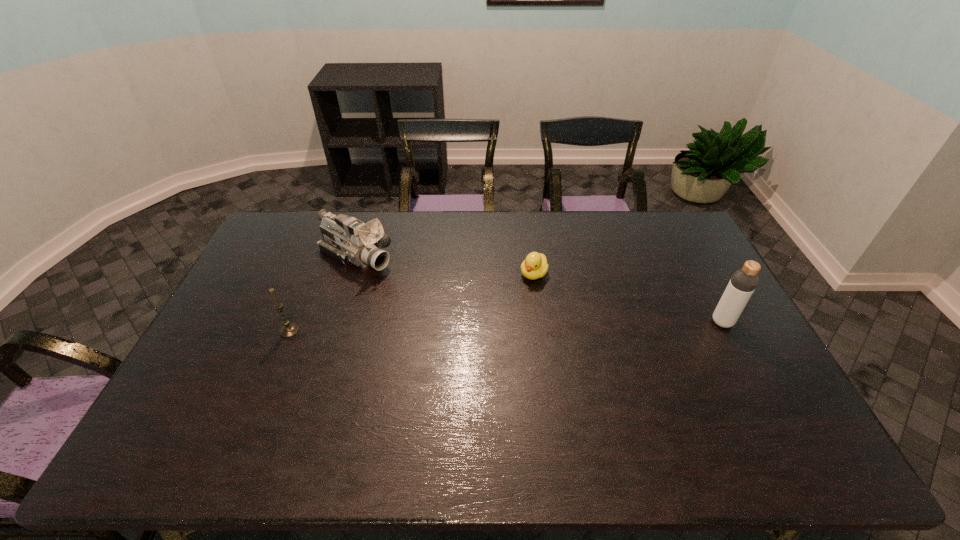
Where is `vacant space at the far right corner of the desktop`? Image resolution: width=960 pixels, height=540 pixels. vacant space at the far right corner of the desktop is located at coordinates (659, 216).

Where is `free space at the near right corner`? free space at the near right corner is located at coordinates (767, 419).

This screenshot has width=960, height=540. Identify the location of vacant space in between the camcorder and the candle. (323, 294).

Where is `vacant area that lies between the candle and the camcorder`? vacant area that lies between the candle and the camcorder is located at coordinates (323, 294).

The image size is (960, 540). I want to click on free space between the duckling and the bottle, so click(x=628, y=298).

Find the location of `vacant area that lies between the candle and the camcorder`. vacant area that lies between the candle and the camcorder is located at coordinates (323, 294).

At what (x,y) coordinates should I click in order to perform the action: click on empty space between the camcorder and the third object from left to right. Please return your answer as a coordinate pair (x, y). The image size is (960, 540). Looking at the image, I should click on (444, 266).

Where is `vacant space in between the candle and the tallest object`? vacant space in between the candle and the tallest object is located at coordinates (506, 327).

The image size is (960, 540). In order to click on free spot between the duckling and the candle in this screenshot , I will do `click(412, 302)`.

Locate an element on the screen. This screenshot has width=960, height=540. free space between the second object from right to left and the candle is located at coordinates (412, 302).